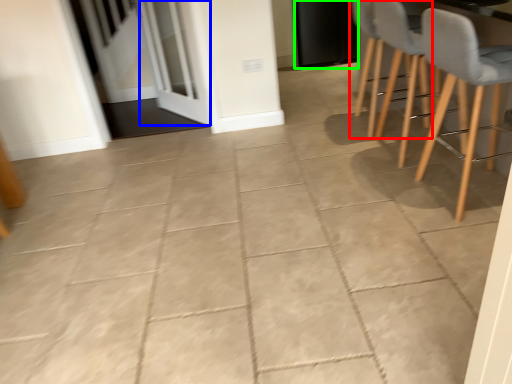
Question: Considering the real-world distances, which object is closest to chair (highlighted by a red box)? screen door (highlighted by a blue box) or door (highlighted by a green box).

Choices:
 (A) screen door
 (B) door

Answer: (B)